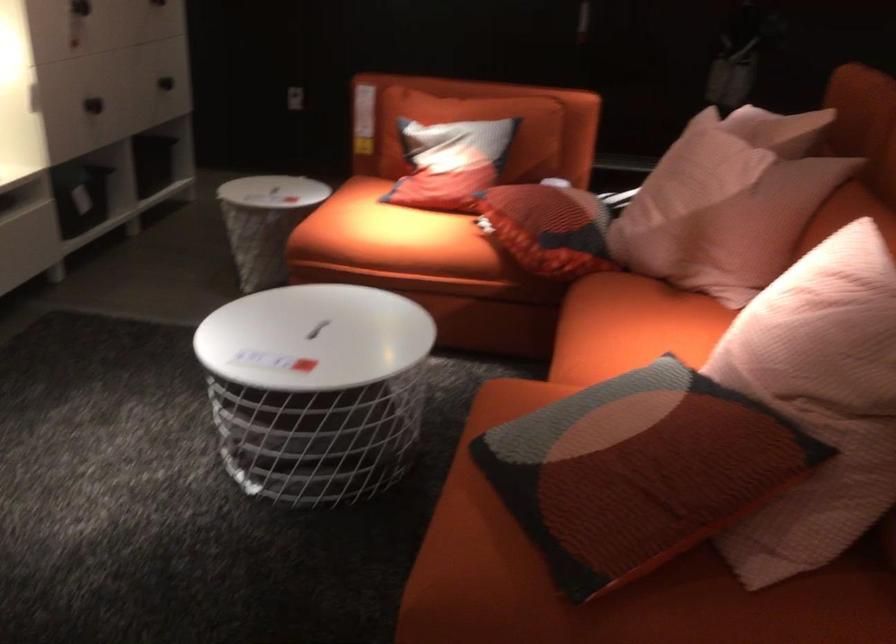
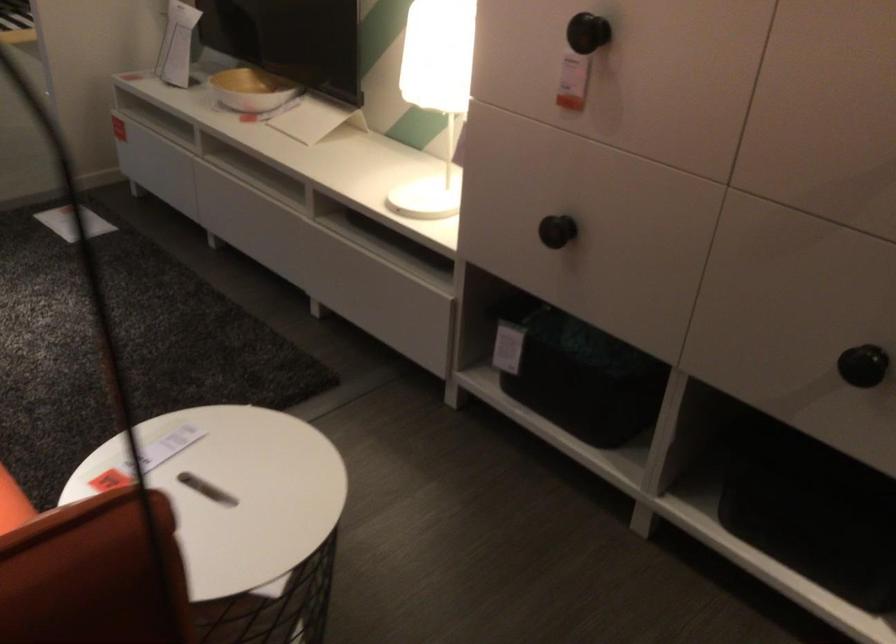
Locate, in the second image, the point that corresponds to point (116, 90) in the first image.

(556, 231)